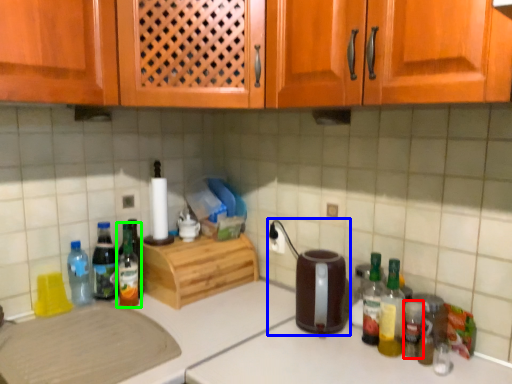
Question: Which is nearer to the bottle (highlighted by a red box)? appliance (highlighted by a blue box) or bottle (highlighted by a green box).

Choices:
 (A) appliance
 (B) bottle

Answer: (A)